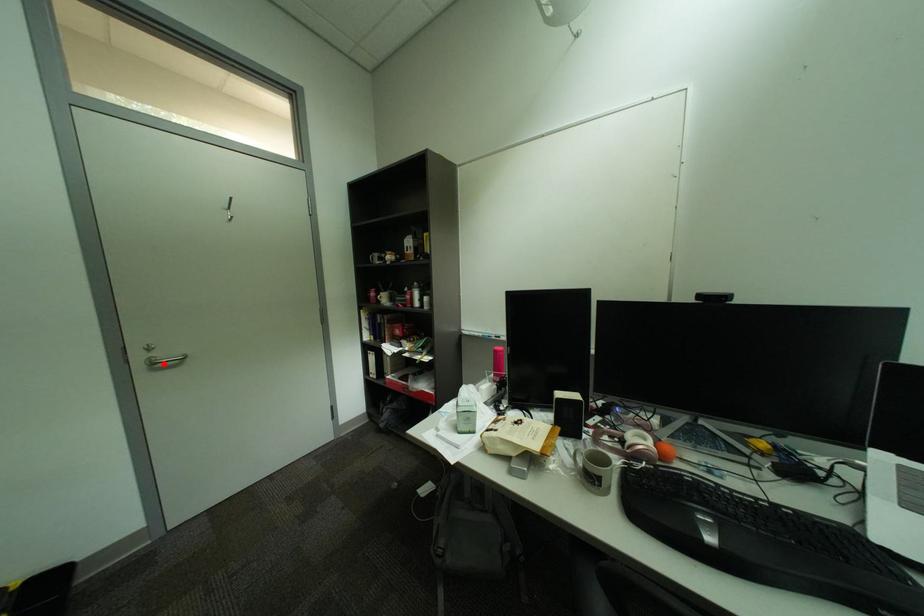
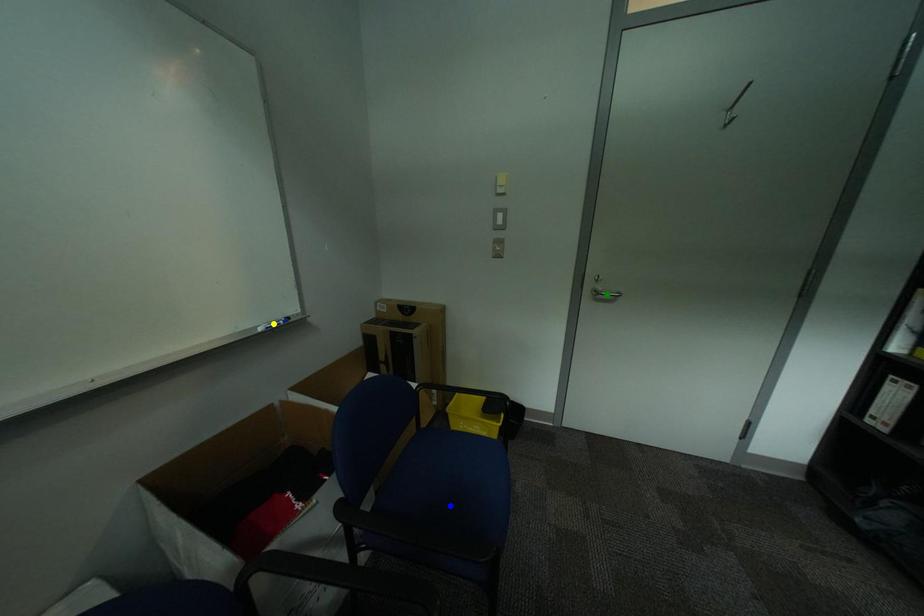
Question: I am providing you with two images of the same scene from different viewpoints. A red point is marked on the first image. You are given multiple points on the second image. Which point in image 2 represents the same 3d spot as the red point in image 1?

Choices:
 (A) green point
 (B) yellow point
 (C) blue point

Answer: (A)